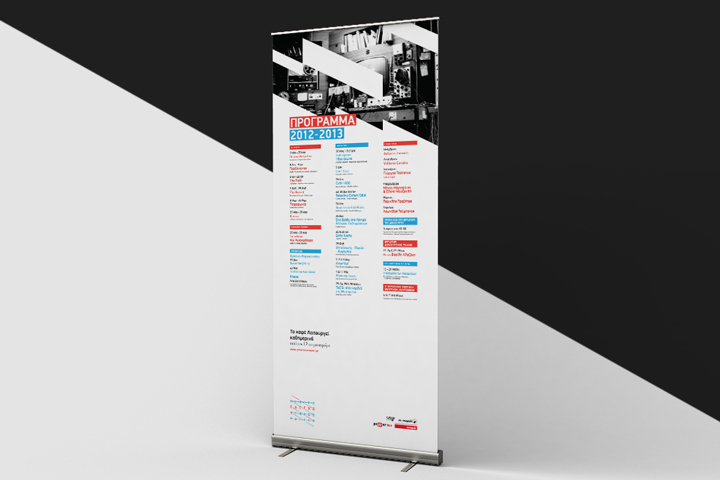
The width and height of the screenshot is (720, 480). What are the coordinates of `tv screen` in the screenshot? It's located at (379, 63).